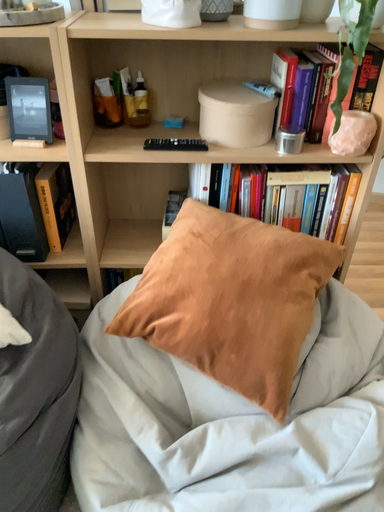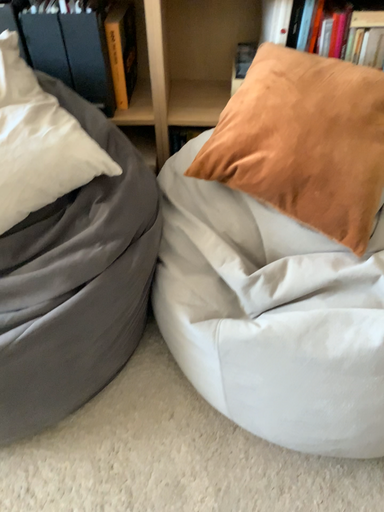
Question: How did the camera likely rotate when shooting the video?

Choices:
 (A) rotated upward
 (B) rotated downward

Answer: (B)